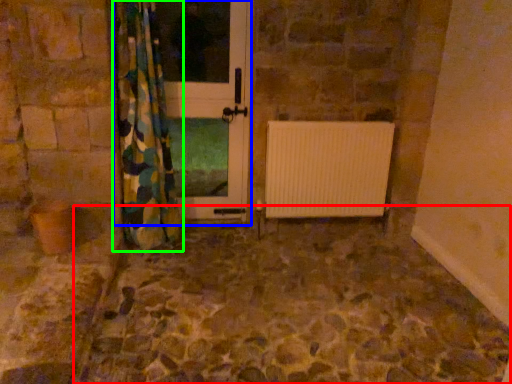
Question: Which object is the farthest from path (highlighted by a red box)? Choose among these: screen door (highlighted by a blue box) or curtain (highlighted by a green box).

Choices:
 (A) screen door
 (B) curtain

Answer: (A)